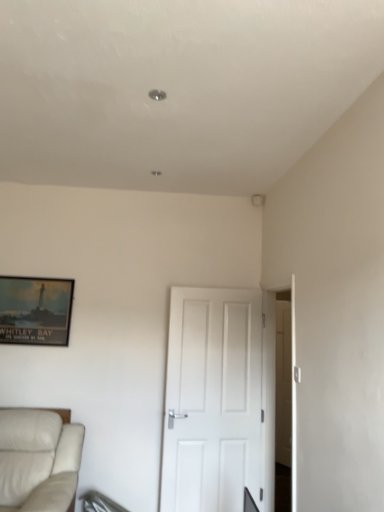
Question: From the image's perspective, is matte black picture frame at upper left beneath white leather studio couch at lower left?

Choices:
 (A) yes
 (B) no

Answer: (B)

Question: Does matte black picture frame at upper left have a smaller size compared to white leather studio couch at lower left?

Choices:
 (A) no
 (B) yes

Answer: (B)

Question: Can you confirm if matte black picture frame at upper left is wider than white leather studio couch at lower left?

Choices:
 (A) yes
 (B) no

Answer: (B)

Question: From a real-world perspective, does matte black picture frame at upper left stand above white leather studio couch at lower left?

Choices:
 (A) yes
 (B) no

Answer: (A)

Question: Is matte black picture frame at upper left not near white leather studio couch at lower left?

Choices:
 (A) yes
 (B) no

Answer: (B)

Question: Do you think matte black picture frame at upper left is within white matte door at center, or outside of it?

Choices:
 (A) outside
 (B) inside

Answer: (A)

Question: Considering their positions, is matte black picture frame at upper left located in front of or behind white matte door at center?

Choices:
 (A) behind
 (B) front

Answer: (A)

Question: From a real-world perspective, is matte black picture frame at upper left positioned above or below white matte door at center?

Choices:
 (A) above
 (B) below

Answer: (A)

Question: Is matte black picture frame at upper left wider or thinner than white matte door at center?

Choices:
 (A) wide
 (B) thin

Answer: (B)

Question: From a real-world perspective, relative to matte black picture frame at upper left, is white matte door at center vertically above or below?

Choices:
 (A) above
 (B) below

Answer: (B)

Question: From the image's perspective, is white matte door at center located above or below matte black picture frame at upper left?

Choices:
 (A) below
 (B) above

Answer: (A)

Question: Would you say white matte door at center is inside or outside matte black picture frame at upper left?

Choices:
 (A) outside
 (B) inside

Answer: (A)

Question: Would you say white matte door at center is to the left or to the right of matte black picture frame at upper left in the picture?

Choices:
 (A) left
 (B) right

Answer: (B)

Question: Is matte black picture frame at upper left in front of or behind white leather studio couch at lower left in the image?

Choices:
 (A) front
 (B) behind

Answer: (B)

Question: From the image's perspective, relative to white leather studio couch at lower left, is matte black picture frame at upper left above or below?

Choices:
 (A) above
 (B) below

Answer: (A)